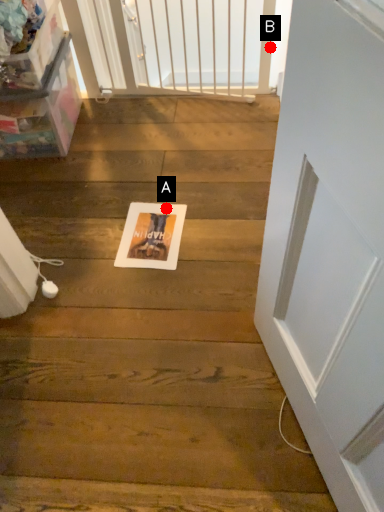
Question: Two points are circled on the image, labeled by A and B beside each circle. Among these points, which one is farthest from the camera?

Choices:
 (A) A is further
 (B) B is further

Answer: (B)